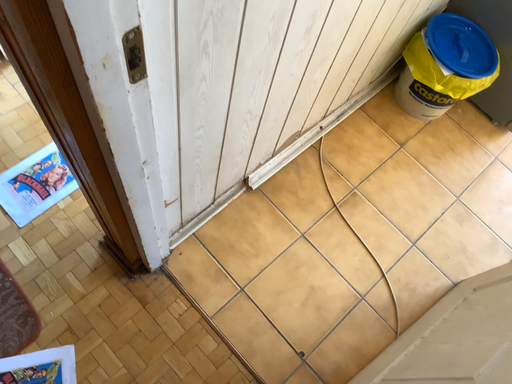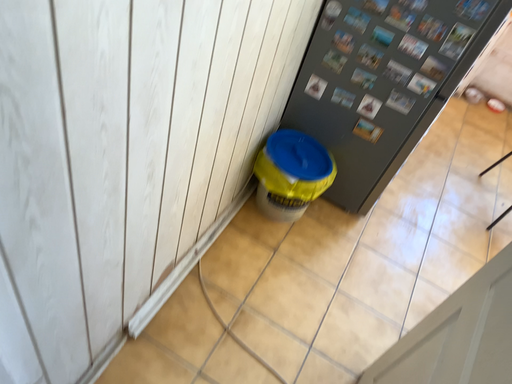
Question: How did the camera likely rotate when shooting the video?

Choices:
 (A) rotated right
 (B) rotated left

Answer: (A)